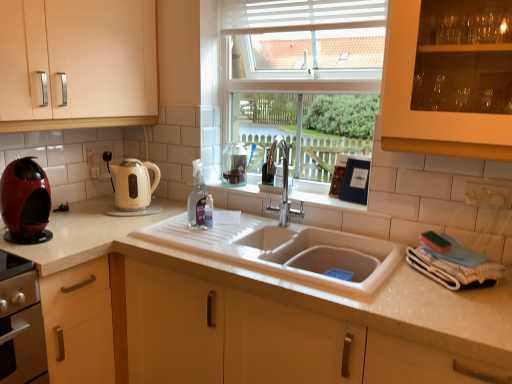
Question: Does cream matte electric kettle at left, positioned as the first kitchen appliance in right-to-left order, have a greater height compared to clear glass spray bottle at center?

Choices:
 (A) no
 (B) yes

Answer: (A)

Question: Is cream matte electric kettle at left, positioned as the first kitchen appliance in right-to-left order, placed right next to clear glass spray bottle at center?

Choices:
 (A) yes
 (B) no

Answer: (B)

Question: Could you tell me if cream matte electric kettle at left, which is the 2th kitchen appliance in front-to-back order, is turned towards clear glass spray bottle at center?

Choices:
 (A) no
 (B) yes

Answer: (B)

Question: Does cream matte electric kettle at left, positioned as the first kitchen appliance in right-to-left order, have a lesser width compared to clear glass spray bottle at center?

Choices:
 (A) no
 (B) yes

Answer: (A)

Question: Is cream matte electric kettle at left, which is the 1th kitchen appliance from back to front, not near clear glass spray bottle at center?

Choices:
 (A) no
 (B) yes

Answer: (A)

Question: From a real-world perspective, is cream matte electric kettle at left, the second kitchen appliance from the left, on clear glass spray bottle at center?

Choices:
 (A) no
 (B) yes

Answer: (A)

Question: Is matte cream cabinet at left aimed at clear glass spray bottle at center?

Choices:
 (A) no
 (B) yes

Answer: (A)

Question: From a real-world perspective, is matte cream cabinet at left on top of clear glass spray bottle at center?

Choices:
 (A) yes
 (B) no

Answer: (A)

Question: Is matte cream cabinet at left further to camera compared to clear glass spray bottle at center?

Choices:
 (A) no
 (B) yes

Answer: (A)

Question: Is matte cream cabinet at left positioned with its back to clear glass spray bottle at center?

Choices:
 (A) no
 (B) yes

Answer: (A)

Question: Considering the relative sizes of matte cream cabinet at left and clear glass spray bottle at center in the image provided, is matte cream cabinet at left wider than clear glass spray bottle at center?

Choices:
 (A) no
 (B) yes

Answer: (B)

Question: Is matte cream cabinet at left positioned in front of clear glass spray bottle at center?

Choices:
 (A) no
 (B) yes

Answer: (B)

Question: Is shiny red coffee machine at left, which is the 2th kitchen appliance in right-to-left order, taller than matte cream cabinet at left?

Choices:
 (A) yes
 (B) no

Answer: (B)